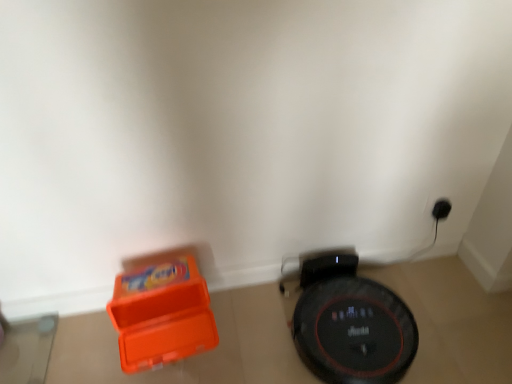
Question: Is black glossy robot vacuum cleaner at lower right touching orange plastic toy at lower left?

Choices:
 (A) no
 (B) yes

Answer: (A)

Question: From a real-world perspective, is black glossy robot vacuum cleaner at lower right under orange plastic toy at lower left?

Choices:
 (A) yes
 (B) no

Answer: (A)

Question: From the image's perspective, is black glossy robot vacuum cleaner at lower right on top of orange plastic toy at lower left?

Choices:
 (A) yes
 (B) no

Answer: (B)

Question: Can you confirm if black glossy robot vacuum cleaner at lower right is smaller than orange plastic toy at lower left?

Choices:
 (A) yes
 (B) no

Answer: (B)

Question: From the image's perspective, is black glossy robot vacuum cleaner at lower right beneath orange plastic toy at lower left?

Choices:
 (A) yes
 (B) no

Answer: (A)

Question: Is black glossy robot vacuum cleaner at lower right completely or partially outside of orange plastic toy at lower left?

Choices:
 (A) yes
 (B) no

Answer: (A)

Question: Is orange plastic toy at lower left aimed at black glossy robot vacuum cleaner at lower right?

Choices:
 (A) no
 (B) yes

Answer: (A)

Question: Does orange plastic toy at lower left lie behind black glossy robot vacuum cleaner at lower right?

Choices:
 (A) yes
 (B) no

Answer: (B)

Question: Is orange plastic toy at lower left shorter than black glossy robot vacuum cleaner at lower right?

Choices:
 (A) yes
 (B) no

Answer: (B)

Question: From a real-world perspective, is orange plastic toy at lower left physically above black glossy robot vacuum cleaner at lower right?

Choices:
 (A) yes
 (B) no

Answer: (A)

Question: Is orange plastic toy at lower left wider than black glossy robot vacuum cleaner at lower right?

Choices:
 (A) yes
 (B) no

Answer: (B)

Question: From the image's perspective, does orange plastic toy at lower left appear higher than black glossy robot vacuum cleaner at lower right?

Choices:
 (A) yes
 (B) no

Answer: (A)

Question: Considering their positions, is orange plastic toy at lower left located in front of or behind black glossy robot vacuum cleaner at lower right?

Choices:
 (A) behind
 (B) front

Answer: (B)